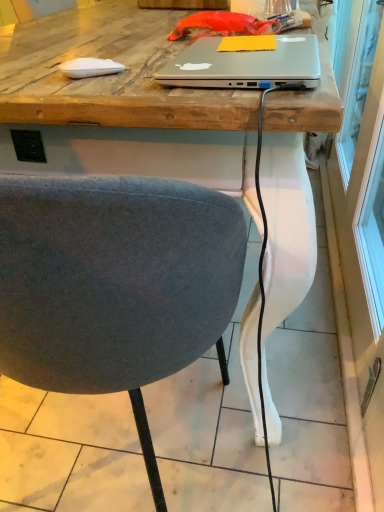
Question: Is transparent glass screen door at right wider than textured gray chair at center?

Choices:
 (A) yes
 (B) no

Answer: (B)

Question: Is transparent glass screen door at right outside of textured gray chair at center?

Choices:
 (A) yes
 (B) no

Answer: (A)

Question: Is transparent glass screen door at right positioned far away from textured gray chair at center?

Choices:
 (A) yes
 (B) no

Answer: (B)

Question: Is transparent glass screen door at right turned away from textured gray chair at center?

Choices:
 (A) no
 (B) yes

Answer: (A)

Question: From the image's perspective, is transparent glass screen door at right under textured gray chair at center?

Choices:
 (A) no
 (B) yes

Answer: (A)

Question: Is the depth of transparent glass screen door at right less than that of textured gray chair at center?

Choices:
 (A) no
 (B) yes

Answer: (A)

Question: From a real-world perspective, is satin silver laptop at center positioned over transparent glass screen door at right based on gravity?

Choices:
 (A) no
 (B) yes

Answer: (B)

Question: Considering the relative sizes of satin silver laptop at center and transparent glass screen door at right in the image provided, is satin silver laptop at center bigger than transparent glass screen door at right?

Choices:
 (A) no
 (B) yes

Answer: (A)

Question: From a real-world perspective, is satin silver laptop at center beneath transparent glass screen door at right?

Choices:
 (A) no
 (B) yes

Answer: (A)

Question: Is satin silver laptop at center further to the viewer compared to transparent glass screen door at right?

Choices:
 (A) yes
 (B) no

Answer: (A)

Question: Is satin silver laptop at center completely or partially outside of transparent glass screen door at right?

Choices:
 (A) no
 (B) yes

Answer: (B)

Question: Is satin silver laptop at center directly adjacent to transparent glass screen door at right?

Choices:
 (A) no
 (B) yes

Answer: (A)

Question: Does textured gray chair at center come in front of satin silver laptop at center?

Choices:
 (A) no
 (B) yes

Answer: (B)